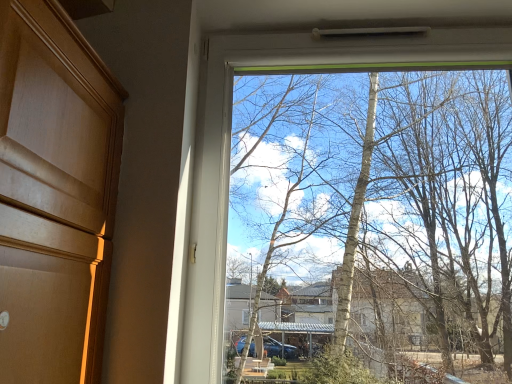
This screenshot has width=512, height=384. Describe the element at coordinates (376, 210) in the screenshot. I see `bare branches at center` at that location.

Image resolution: width=512 pixels, height=384 pixels. Find the location of `bare branches at center`. bare branches at center is located at coordinates (376, 210).

Find the location of a particular element. bare branches at center is located at coordinates (376, 210).